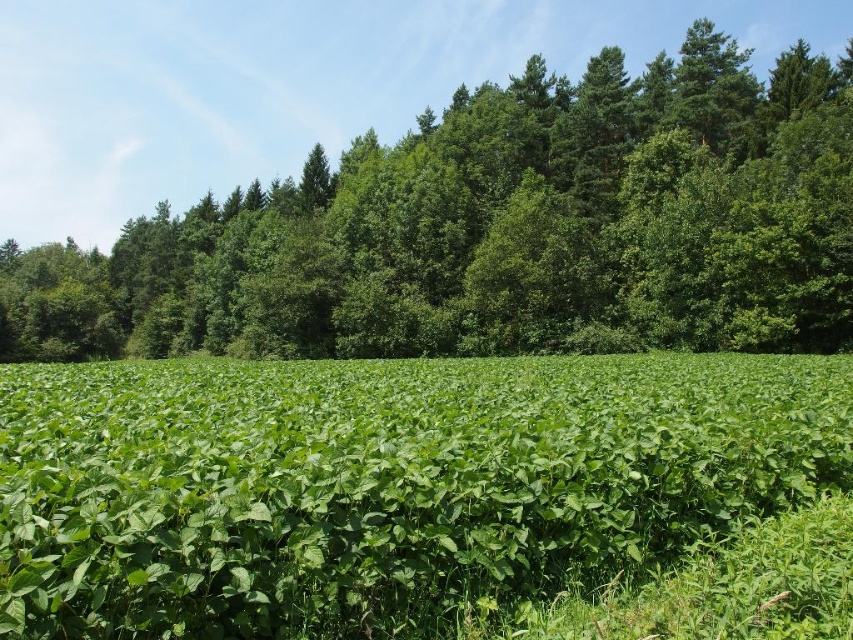
Is green leafy field at center smaller than green leafy tree at center?

Indeed, green leafy field at center has a smaller size compared to green leafy tree at center.

Can you confirm if green leafy field at center is wider than green leafy tree at center?

Incorrect, green leafy field at center's width does not surpass green leafy tree at center's.

Is point (213, 467) more distant than point (666, 140)?

No.

You are a GUI agent. You are given a task and a screenshot of the screen. Output one action in this format:
    pyautogui.click(x=<x>, y=<y>)
    Task: Click on the green leafy field at center
    Image resolution: width=853 pixels, height=640 pixels.
    Given the screenshot: What is the action you would take?
    pyautogui.click(x=383, y=484)